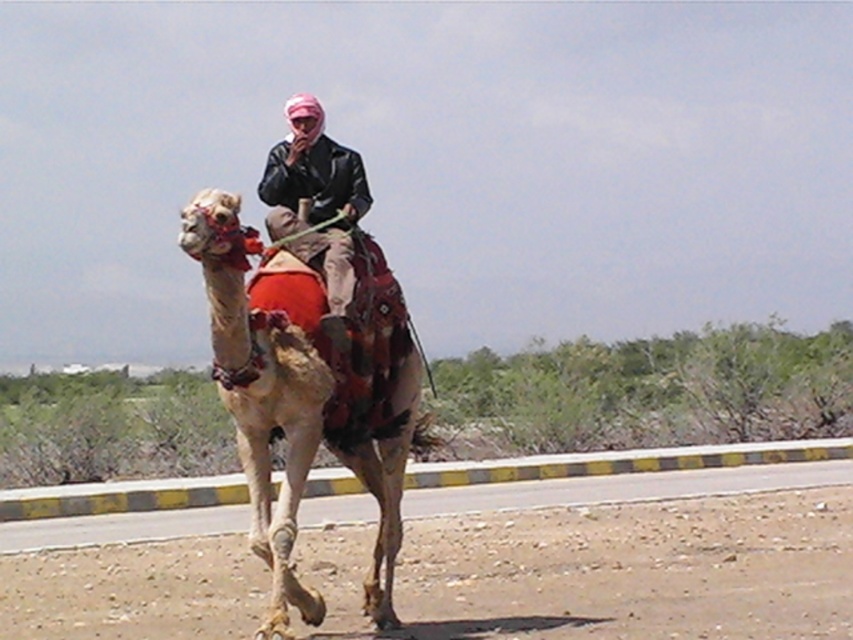
Is the position of brown textured sand at lower center more distant than that of light brown textured camel at center?

Yes, brown textured sand at lower center is further from the viewer.

This screenshot has height=640, width=853. What are the coordinates of `brown textured sand at lower center` in the screenshot? It's located at (608, 570).

Measure the distance between light brown textured camel at center and leather jacket at center.

35.30 inches

Does light brown textured camel at center have a lesser height compared to leather jacket at center?

Incorrect, light brown textured camel at center's height does not fall short of leather jacket at center's.

Where is `light brown textured camel at center`? light brown textured camel at center is located at coordinates (303, 394).

Is brown textured sand at lower center further to camera compared to leather jacket at center?

That is True.

Which of these two, brown textured sand at lower center or leather jacket at center, stands shorter?

brown textured sand at lower center

This screenshot has width=853, height=640. What do you see at coordinates (608, 570) in the screenshot?
I see `brown textured sand at lower center` at bounding box center [608, 570].

Find the location of a particular element. The width and height of the screenshot is (853, 640). brown textured sand at lower center is located at coordinates (608, 570).